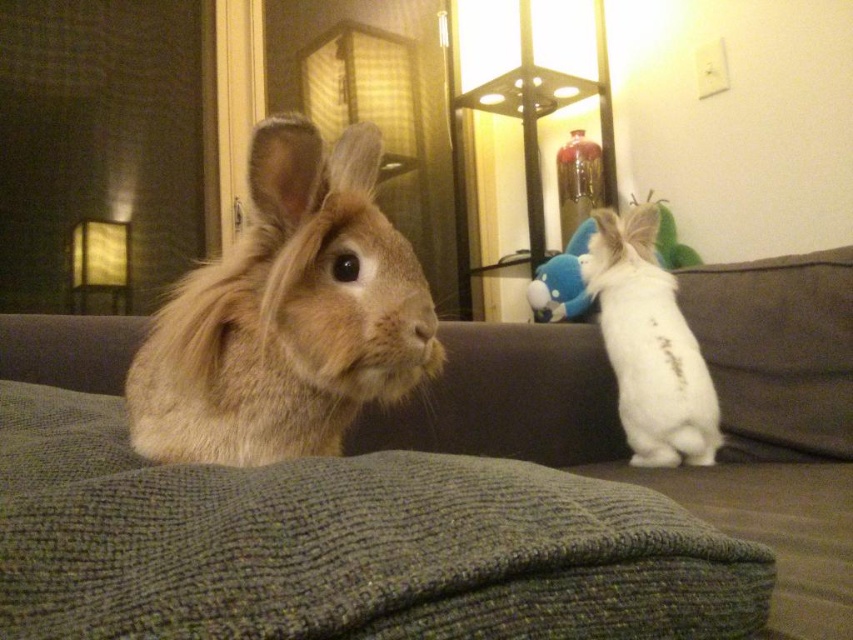
Question: Considering the relative positions of fuzzy beige rabbit at left and blue plush toy at right in the image provided, where is fuzzy beige rabbit at left located with respect to blue plush toy at right?

Choices:
 (A) left
 (B) right

Answer: (A)

Question: Which point is farther to the camera?

Choices:
 (A) (292, 445)
 (B) (538, 298)

Answer: (B)

Question: In this image, where is white fluffy rabbit at right located relative to blue plush toy at right?

Choices:
 (A) right
 (B) left

Answer: (B)

Question: Among these points, which one is nearest to the camera?

Choices:
 (A) (601, 269)
 (B) (163, 449)

Answer: (B)

Question: Does green knitted couch at center have a larger size compared to fuzzy beige rabbit at left?

Choices:
 (A) no
 (B) yes

Answer: (B)

Question: Which object appears closest to the camera in this image?

Choices:
 (A) green knitted couch at center
 (B) fuzzy beige rabbit at left

Answer: (A)